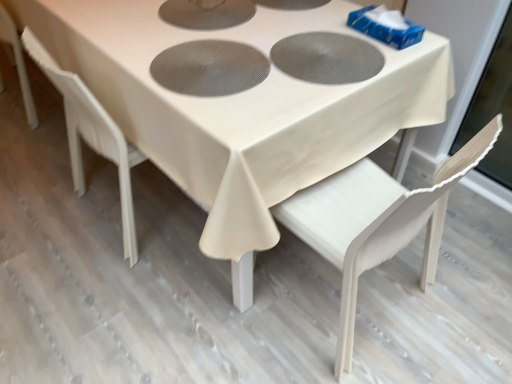
This screenshot has height=384, width=512. I want to click on free space on the front side of white plastic chair at lower left, acting as the first chair starting from the left, so click(121, 294).